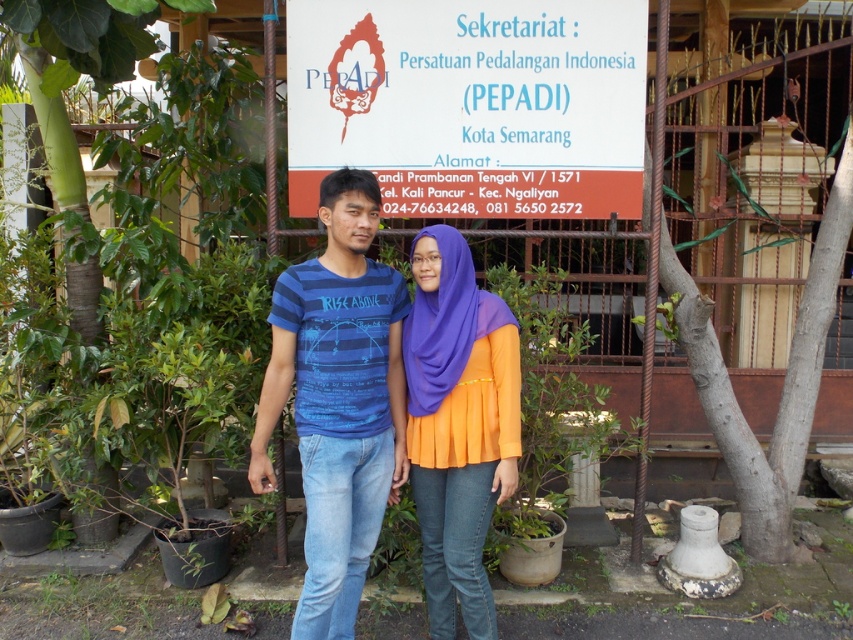
Does white paper sign at upper center have a smaller size compared to green leafy plant at lower center?

Actually, white paper sign at upper center might be larger than green leafy plant at lower center.

Does white paper sign at upper center come behind green leafy plant at lower center?

Yes, it is behind green leafy plant at lower center.

Which is behind, point (300, 32) or point (843, 602)?

The point (300, 32) is behind.

Where is `white paper sign at upper center`? white paper sign at upper center is located at coordinates (469, 104).

Can you confirm if blue striped t-shirt at center is positioned to the left of orange pleated blouse at center?

Correct, you'll find blue striped t-shirt at center to the left of orange pleated blouse at center.

Measure the distance from blue striped t-shirt at center to orange pleated blouse at center.

A distance of 11.98 inches exists between blue striped t-shirt at center and orange pleated blouse at center.

Who is more forward, (273, 364) or (503, 374)?

Point (503, 374) is in front.

Image resolution: width=853 pixels, height=640 pixels. What are the coordinates of `blue striped t-shirt at center` in the screenshot? It's located at (337, 400).

Can you confirm if orange pleated blouse at center is smaller than green leafy plant at lower center?

Incorrect, orange pleated blouse at center is not smaller in size than green leafy plant at lower center.

Is orange pleated blouse at center above green leafy plant at lower center?

Yes, orange pleated blouse at center is above green leafy plant at lower center.

This screenshot has width=853, height=640. Describe the element at coordinates (457, 424) in the screenshot. I see `orange pleated blouse at center` at that location.

This screenshot has height=640, width=853. What are the coordinates of `orange pleated blouse at center` in the screenshot? It's located at (457, 424).